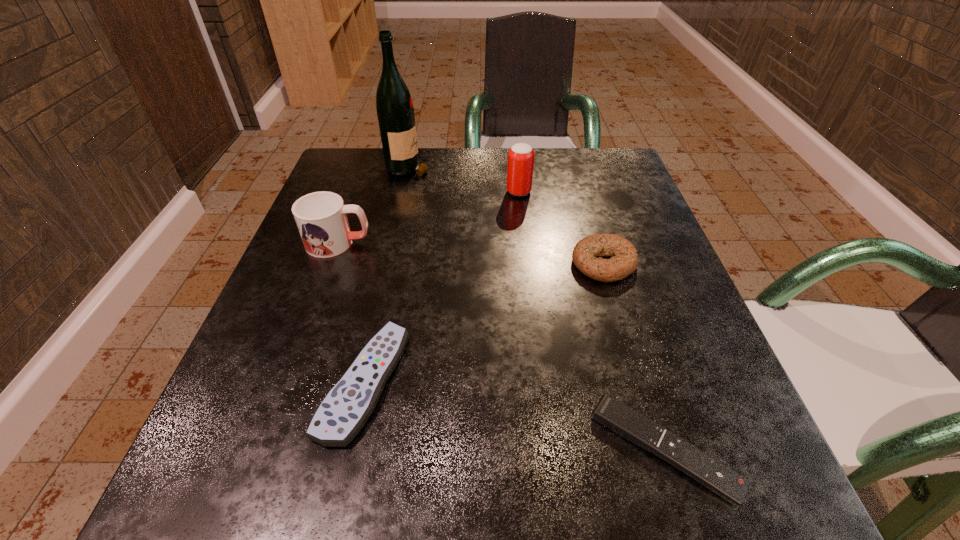
This screenshot has width=960, height=540. Identify the location of vacant area at the far left corner. (336, 170).

The image size is (960, 540). I want to click on free region at the near left corner of the desktop, so click(199, 485).

This screenshot has width=960, height=540. I want to click on free space at the far right corner of the desktop, so click(617, 174).

Image resolution: width=960 pixels, height=540 pixels. I want to click on vacant area at the near right corner of the desktop, so click(708, 516).

Where is `vacant area that lies between the taller remote control and the bagel`? vacant area that lies between the taller remote control and the bagel is located at coordinates (484, 323).

Identify the location of vacant space that's between the tallest object and the third shortest object. The width and height of the screenshot is (960, 540). [x=506, y=214].

Identify the location of empty space that is in between the tallest object and the fourth shortest object. coord(373,205).

At what (x,y) coordinates should I click in order to perform the action: click on vacant area between the fifth nearest object and the second shortest object. Please return your answer as a coordinate pair (x, y). This screenshot has width=960, height=540. Looking at the image, I should click on (442, 287).

Identify the location of free spot between the shortest object and the farthest object. This screenshot has width=960, height=540. (537, 308).

At what (x,y) coordinates should I click in order to perform the action: click on empty space that is in between the left remote control and the bagel. Please return your answer as a coordinate pair (x, y). The image size is (960, 540). Looking at the image, I should click on (484, 323).